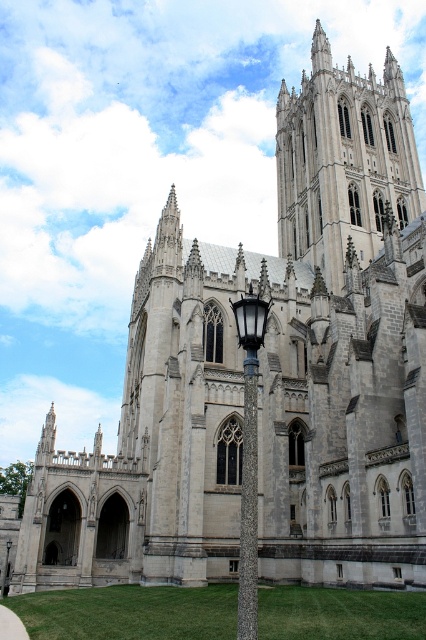
Question: Which of the following is the closest to the observer?

Choices:
 (A) (276, 147)
 (B) (253, 451)

Answer: (B)

Question: Does gray stone tower at upper center come in front of polished brass lamp post at center?

Choices:
 (A) yes
 (B) no

Answer: (B)

Question: Does gray stone tower at upper center appear on the right side of polished brass lamp post at center?

Choices:
 (A) no
 (B) yes

Answer: (B)

Question: Is gray stone tower at upper center further to the viewer compared to polished brass lamp post at center?

Choices:
 (A) no
 (B) yes

Answer: (B)

Question: Which of the following is the closest to the observer?

Choices:
 (A) (249, 442)
 (B) (319, 104)

Answer: (A)